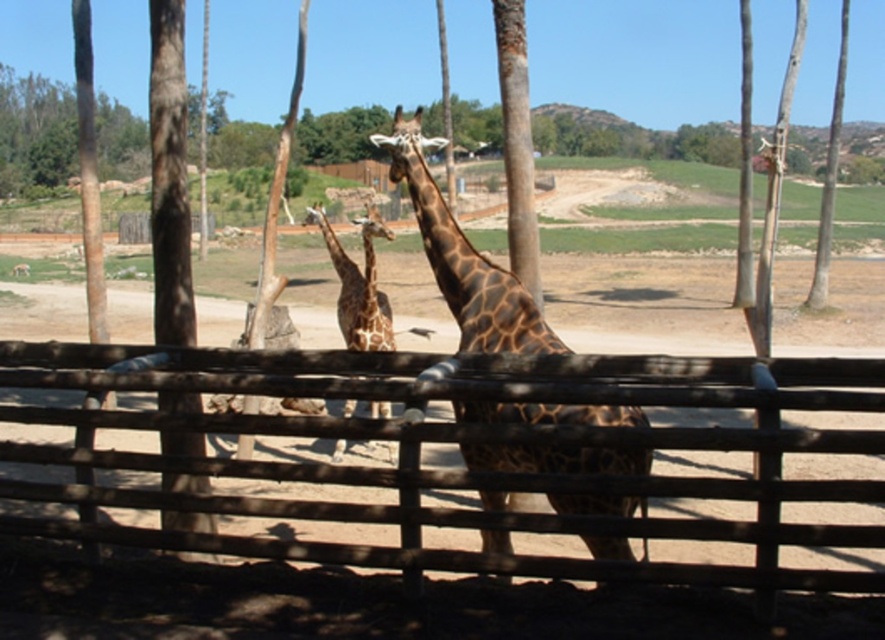
Can you confirm if brown wooden fence at center is smaller than spotted brown giraffe at center?

Indeed, brown wooden fence at center has a smaller size compared to spotted brown giraffe at center.

Image resolution: width=885 pixels, height=640 pixels. I want to click on brown wooden fence at center, so coord(462,452).

Which is above, brown wooden fence at center or brown spotted giraffe at center?

brown wooden fence at center

Is brown wooden fence at center bigger than brown spotted giraffe at center?

Correct, brown wooden fence at center is larger in size than brown spotted giraffe at center.

Image resolution: width=885 pixels, height=640 pixels. Identify the location of brown wooden fence at center. (462, 452).

Does brown spotted giraffe at center appear on the right side of spotted brown giraffe at center?

Correct, you'll find brown spotted giraffe at center to the right of spotted brown giraffe at center.

Is brown spotted giraffe at center closer to camera compared to spotted brown giraffe at center?

No, it is behind spotted brown giraffe at center.

Locate an element on the screen. This screenshot has width=885, height=640. brown spotted giraffe at center is located at coordinates (463, 259).

In order to click on brown spotted giraffe at center in this screenshot , I will do `click(463, 259)`.